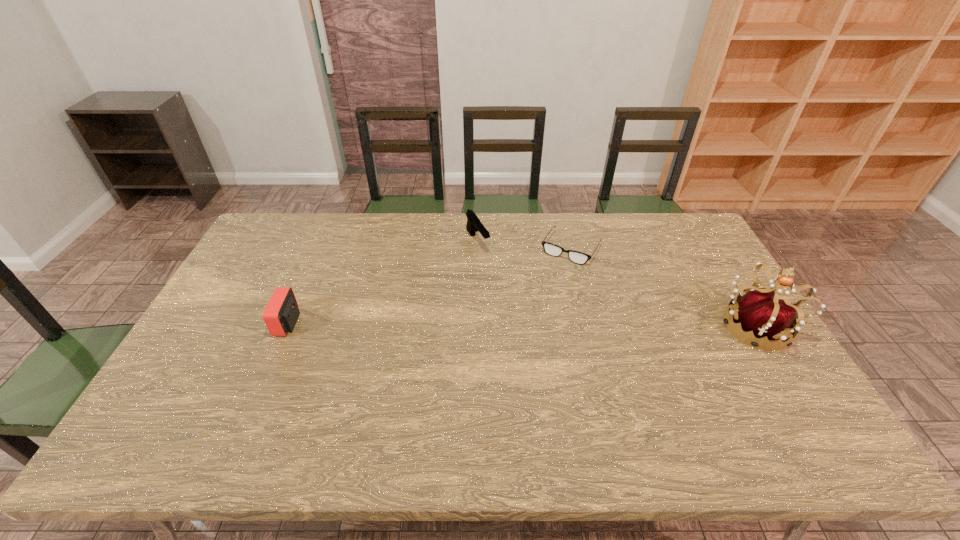
Find the location of `vacant space positioned 0.100m on the front-facing side of the third object from left to right`. vacant space positioned 0.100m on the front-facing side of the third object from left to right is located at coordinates (549, 283).

This screenshot has height=540, width=960. In order to click on free spot located 0.210m on the front-facing side of the third object from left to right in this screenshot , I will do `click(536, 305)`.

Locate an element on the screen. Image resolution: width=960 pixels, height=540 pixels. free space located on the front-facing side of the pistol is located at coordinates (507, 289).

You are a GUI agent. You are given a task and a screenshot of the screen. Output one action in this format:
    pyautogui.click(x=<x>, y=<y>)
    Task: Click on the free space located 0.190m on the front-facing side of the pistol
    The image size is (960, 540).
    Given the screenshot: What is the action you would take?
    pyautogui.click(x=507, y=289)

At what (x,y) coordinates should I click in order to perform the action: click on blank space located on the front-facing side of the pistol. Please return your answer as a coordinate pair (x, y). Looking at the image, I should click on (493, 270).

I want to click on spectacles at the far edge, so click(x=580, y=258).

The image size is (960, 540). I want to click on pistol that is at the far edge, so click(473, 225).

At what (x,y) coordinates should I click in order to perform the action: click on object positioned at the right edge. Please return your answer as a coordinate pair (x, y). Looking at the image, I should click on (760, 312).

Image resolution: width=960 pixels, height=540 pixels. I want to click on vacant point at the far edge, so click(656, 251).

Find the location of a particular element. free region at the near edge of the desktop is located at coordinates (552, 396).